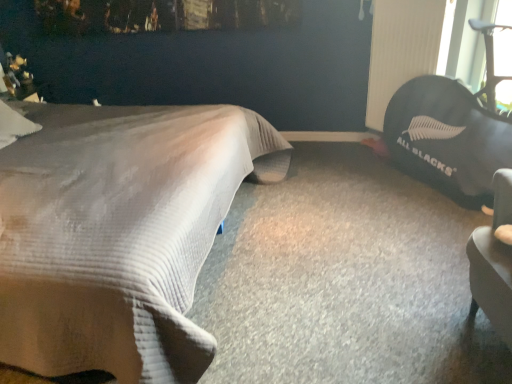
This screenshot has height=384, width=512. What are the coordinates of `black fabric bean bag at right` in the screenshot? It's located at (448, 138).

Where is `black rubber radiator at upper right`? The image size is (512, 384). black rubber radiator at upper right is located at coordinates tap(401, 49).

Does black fabric bean bag at right turn towards beige textured bed at left?

Yes, black fabric bean bag at right is oriented towards beige textured bed at left.

Between black fabric bean bag at right and beige textured bed at left, which one appears on the left side from the viewer's perspective?

beige textured bed at left.

Who is smaller, black fabric bean bag at right or beige textured bed at left?

black fabric bean bag at right is smaller.

In the image, is black rubber radiator at upper right positioned in front of or behind black fabric bean bag at right?

black rubber radiator at upper right is positioned farther from the viewer than black fabric bean bag at right.

From a real-world perspective, which object rests below the other?

black fabric bean bag at right, from a real-world perspective.

Is black rubber radiator at upper right positioned with its back to black fabric bean bag at right?

black rubber radiator at upper right is not turned away from black fabric bean bag at right.

From a real-world perspective, relative to beige textured bed at left, is black rubber radiator at upper right vertically above or below?

black rubber radiator at upper right is situated higher than beige textured bed at left in the real world.

Image resolution: width=512 pixels, height=384 pixels. Find the location of `bed that is in front of the black rubber radiator at upper right`. bed that is in front of the black rubber radiator at upper right is located at coordinates 117,234.

Between black rubber radiator at upper right and beige textured bed at left, which one appears on the left side from the viewer's perspective?

beige textured bed at left.

Can you confirm if black rubber radiator at upper right is thinner than beige textured bed at left?

Indeed, black rubber radiator at upper right has a lesser width compared to beige textured bed at left.

From the picture: Can you confirm if beige textured bed at left is smaller than black rubber radiator at upper right?

No, beige textured bed at left is not smaller than black rubber radiator at upper right.

Which is closer, (69, 215) or (403, 0)?

The point (69, 215) is closer.

Which object is closer to the camera taking this photo, beige textured bed at left or black rubber radiator at upper right?

beige textured bed at left is more forward.

From the image's perspective, is beige textured bed at left located above black rubber radiator at upper right?

No, from the image's perspective, beige textured bed at left is not on top of black rubber radiator at upper right.

Could you tell me if black fabric bean bag at right is facing black rubber radiator at upper right?

No, black fabric bean bag at right is not facing towards black rubber radiator at upper right.

Is black fabric bean bag at right touching black rubber radiator at upper right?

No, black fabric bean bag at right is not with black rubber radiator at upper right.

Does black fabric bean bag at right lie in front of black rubber radiator at upper right?

Yes, it is in front of black rubber radiator at upper right.

Can you tell me how much black fabric bean bag at right and black rubber radiator at upper right differ in facing direction?

They differ by 2.95 degrees in their facing directions.

Which object is further away from the camera taking this photo, beige textured bed at left or black fabric bean bag at right?

black fabric bean bag at right is further from the camera.

Is beige textured bed at left situated inside black fabric bean bag at right or outside?

beige textured bed at left exists outside the volume of black fabric bean bag at right.

Consider the image. Is beige textured bed at left looking in the opposite direction of black fabric bean bag at right?

beige textured bed at left does not have its back to black fabric bean bag at right.

Where is `bean bag chair behind the beige textured bed at left`? The width and height of the screenshot is (512, 384). bean bag chair behind the beige textured bed at left is located at coordinates (448, 138).

I want to click on bean bag chair that appears below the black rubber radiator at upper right (from a real-world perspective), so click(448, 138).

Consider the image. Based on their spatial positions, is beige textured bed at left or black rubber radiator at upper right further from black fabric bean bag at right?

The object further to black fabric bean bag at right is beige textured bed at left.

Considering their positions, is beige textured bed at left positioned closer to black rubber radiator at upper right than black fabric bean bag at right?

black fabric bean bag at right is closer to black rubber radiator at upper right.

Estimate the real-world distances between objects in this image. Which object is closer to black rubber radiator at upper right, black fabric bean bag at right or beige textured bed at left?

Based on the image, black fabric bean bag at right appears to be nearer to black rubber radiator at upper right.

When comparing their distances from beige textured bed at left, does black fabric bean bag at right or black rubber radiator at upper right seem further?

Based on the image, black rubber radiator at upper right appears to be further to beige textured bed at left.

Which object lies further to the anchor point black fabric bean bag at right, black rubber radiator at upper right or beige textured bed at left?

The object further to black fabric bean bag at right is beige textured bed at left.

Considering their positions, is black rubber radiator at upper right positioned closer to beige textured bed at left than black fabric bean bag at right?

black fabric bean bag at right lies closer to beige textured bed at left than the other object.

I want to click on radiator located between beige textured bed at left and black fabric bean bag at right in the left-right direction, so click(x=401, y=49).